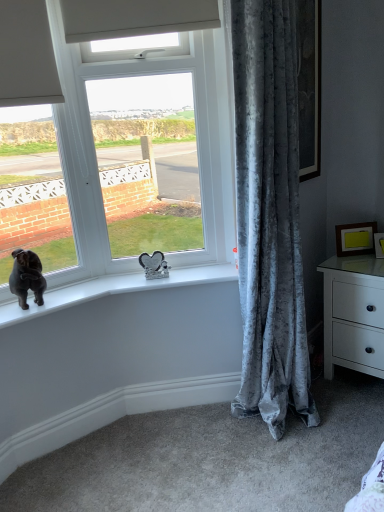
Question: Can you confirm if yellow matte picture frame at upper right, which ranks as the 2th picture frame in right-to-left order, is taller than matte gold picture frame at right, which is the second picture frame in left-to-right order?

Choices:
 (A) yes
 (B) no

Answer: (A)

Question: Is yellow matte picture frame at upper right, which ranks as the 2th picture frame in right-to-left order, at the left side of matte gold picture frame at right, the first picture frame from the right?

Choices:
 (A) no
 (B) yes

Answer: (B)

Question: Is yellow matte picture frame at upper right, which ranks as the 2th picture frame in right-to-left order, with matte gold picture frame at right, which is the second picture frame in left-to-right order?

Choices:
 (A) no
 (B) yes

Answer: (B)

Question: Is yellow matte picture frame at upper right, which ranks as the 2th picture frame in right-to-left order, positioned beyond the bounds of matte gold picture frame at right, which is the second picture frame in left-to-right order?

Choices:
 (A) yes
 (B) no

Answer: (A)

Question: Would you say yellow matte picture frame at upper right, which ranks as the 2th picture frame in right-to-left order, is a long distance from matte gold picture frame at right, which is the second picture frame in left-to-right order?

Choices:
 (A) no
 (B) yes

Answer: (A)

Question: Is matte gold picture frame at right, the first picture frame from the right, located within yellow matte picture frame at upper right, positioned as the 1th picture frame in left-to-right order?

Choices:
 (A) yes
 (B) no

Answer: (B)

Question: Is the position of matte gold picture frame at right, which is the second picture frame in left-to-right order, more distant than that of black velvet dog at window?

Choices:
 (A) no
 (B) yes

Answer: (B)

Question: Does matte gold picture frame at right, the first picture frame from the right, have a smaller size compared to black velvet dog at window?

Choices:
 (A) yes
 (B) no

Answer: (A)

Question: Is matte gold picture frame at right, the first picture frame from the right, to the right of black velvet dog at window from the viewer's perspective?

Choices:
 (A) no
 (B) yes

Answer: (B)

Question: Is matte gold picture frame at right, which is the second picture frame in left-to-right order, far away from black velvet dog at window?

Choices:
 (A) no
 (B) yes

Answer: (B)

Question: Is black velvet dog at window inside matte gold picture frame at right, which is the second picture frame in left-to-right order?

Choices:
 (A) yes
 (B) no

Answer: (B)

Question: Is matte gold picture frame at right, which is the second picture frame in left-to-right order, facing towards black velvet dog at window?

Choices:
 (A) yes
 (B) no

Answer: (B)

Question: Is white plastic window at center bigger than white glossy chest of drawers at right?

Choices:
 (A) no
 (B) yes

Answer: (A)